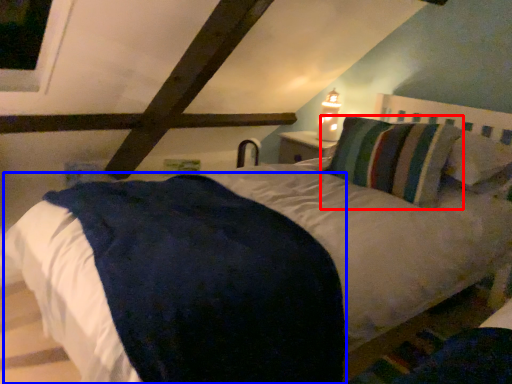
Question: Which object is closer to the camera taking this photo, pillow (highlighted by a red box) or mattress (highlighted by a blue box)?

Choices:
 (A) pillow
 (B) mattress

Answer: (B)